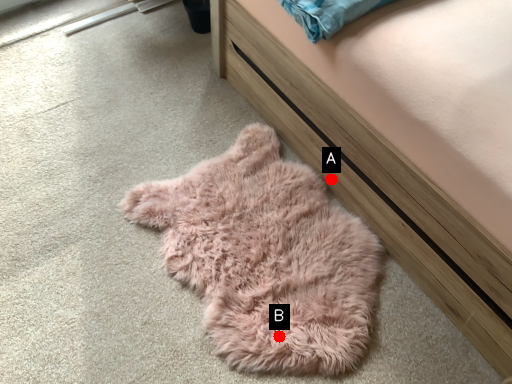
Question: Two points are circled on the image, labeled by A and B beside each circle. Which point is closer to the camera?

Choices:
 (A) A is closer
 (B) B is closer

Answer: (B)